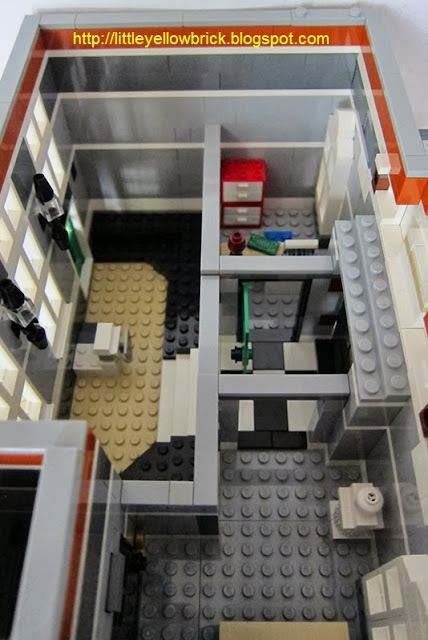
This screenshot has height=640, width=428. Find the location of `closest rectangular window`. closest rectangular window is located at coordinates (10, 378).